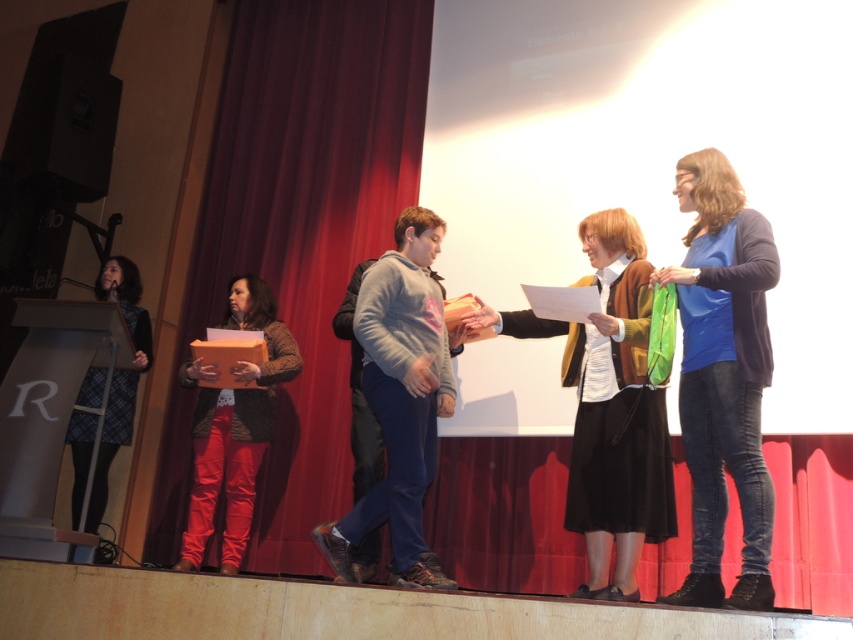
Who is positioned more to the left, red velvet curtain at center or plaid skirt at left?

From the viewer's perspective, plaid skirt at left appears more on the left side.

Is red velvet curtain at center further to the viewer compared to plaid skirt at left?

No, red velvet curtain at center is in front of plaid skirt at left.

Describe the element at coordinates (299, 241) in the screenshot. The image size is (853, 640). I see `red velvet curtain at center` at that location.

What are the coordinates of `red velvet curtain at center` in the screenshot? It's located at (299, 241).

Is point (334, 436) behind point (241, 284)?

No, it is not.

From the picture: Is red velvet curtain at center to the left of matte brown jacket at center from the viewer's perspective?

No, red velvet curtain at center is not to the left of matte brown jacket at center.

Which is behind, point (340, 428) or point (227, 529)?

Point (340, 428)

Find the location of a particular element. This screenshot has height=640, width=853. red velvet curtain at center is located at coordinates (299, 241).

Is point (701, 163) farther from viewer compared to point (200, 438)?

That is False.

Does blue matte shirt at right have a greater height compared to matte brown jacket at center?

No, blue matte shirt at right is not taller than matte brown jacket at center.

Is point (753, 262) closer to viewer compared to point (251, 284)?

Yes, point (753, 262) is closer to viewer.

At what (x,y) coordinates should I click in order to perform the action: click on blue matte shirt at right. Please return your answer as a coordinate pair (x, y). Image resolution: width=853 pixels, height=640 pixels. Looking at the image, I should click on (723, 376).